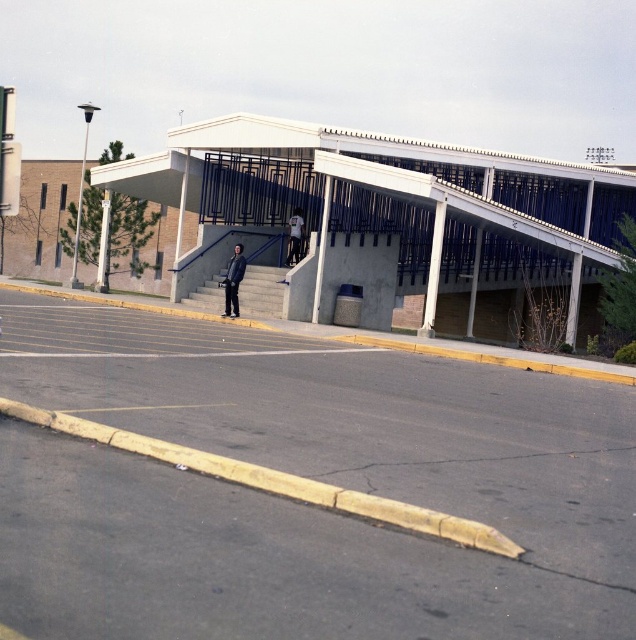
What do you see at coordinates (305, 476) in the screenshot? I see `gray asphalt parking lot at center` at bounding box center [305, 476].

Is point (597, 435) positioned before point (301, 218)?

Yes, point (597, 435) is in front of point (301, 218).

Locate an element on the screen. The height and width of the screenshot is (640, 636). gray asphalt parking lot at center is located at coordinates (305, 476).

Consider the image. Who is lower down, dark blue jacket at center or light blue fabric jacket at center?

dark blue jacket at center is below.

Does dark blue jacket at center appear on the left side of light blue fabric jacket at center?

Indeed, dark blue jacket at center is positioned on the left side of light blue fabric jacket at center.

What do you see at coordinates (233, 282) in the screenshot? The width and height of the screenshot is (636, 640). I see `dark blue jacket at center` at bounding box center [233, 282].

The width and height of the screenshot is (636, 640). I want to click on dark blue jacket at center, so click(233, 282).

In the scene shown: Between gray asphalt parking lot at center and dark blue jacket at center, which one has more height?

dark blue jacket at center

Who is positioned more to the left, gray asphalt parking lot at center or dark blue jacket at center?

dark blue jacket at center

This screenshot has width=636, height=640. What do you see at coordinates (305, 476) in the screenshot? I see `gray asphalt parking lot at center` at bounding box center [305, 476].

I want to click on gray asphalt parking lot at center, so click(305, 476).